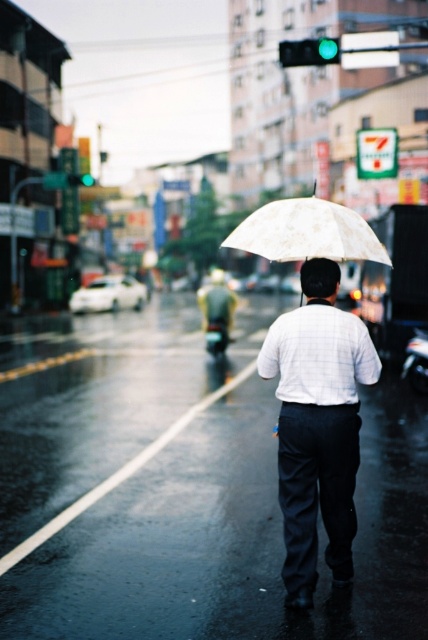
You are standing at the point with coordinates point (321, 205) and want to walk to the point with coordinates point (299, 445). Given the scene described, is the destination point in front of or behind your current position?

The point (299, 445) is in front of point (321, 205), so the destination is in front of your current position.